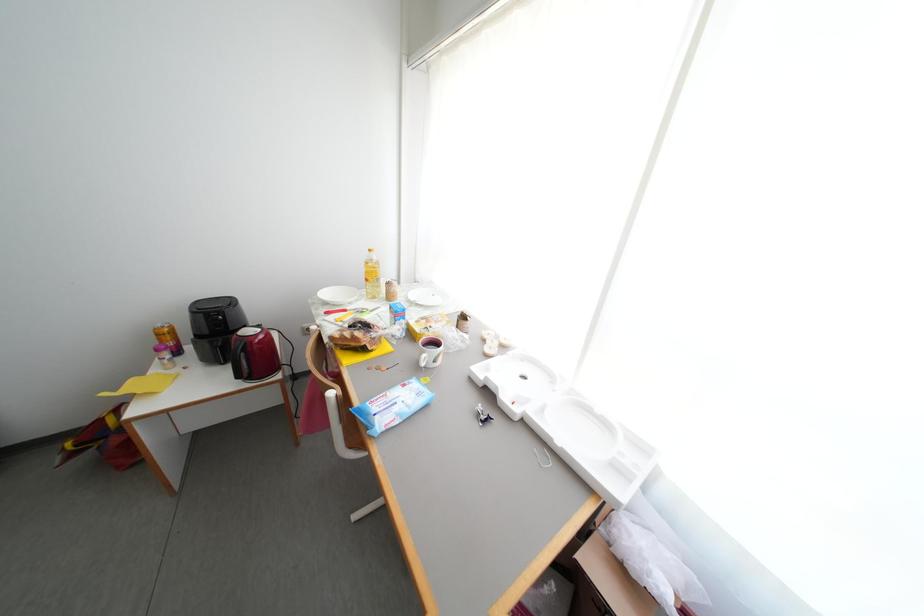
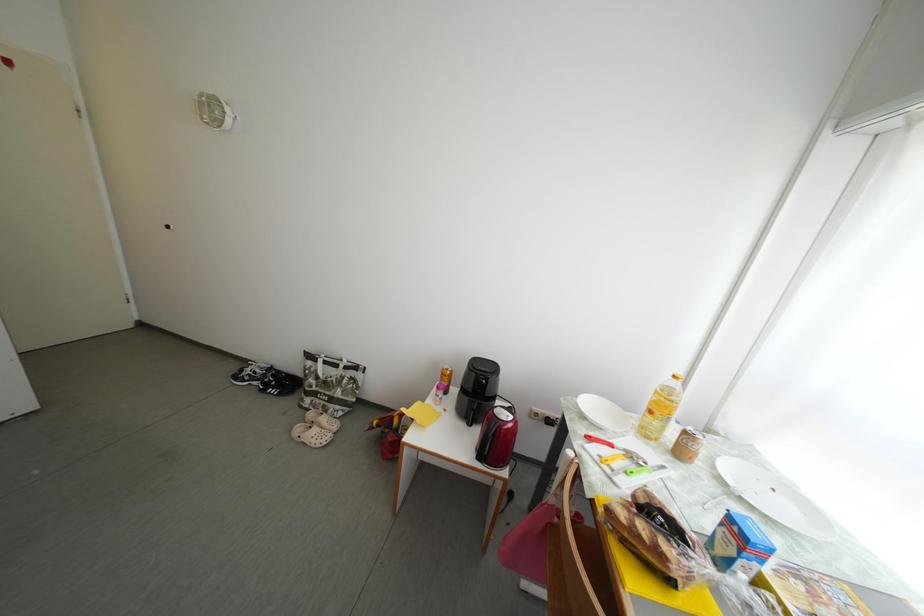
Question: The first image is from the beginning of the video and the second image is from the end. How did the camera likely rotate when shooting the video?

Choices:
 (A) Left
 (B) Right
 (C) Up
 (D) Down

Answer: (A)